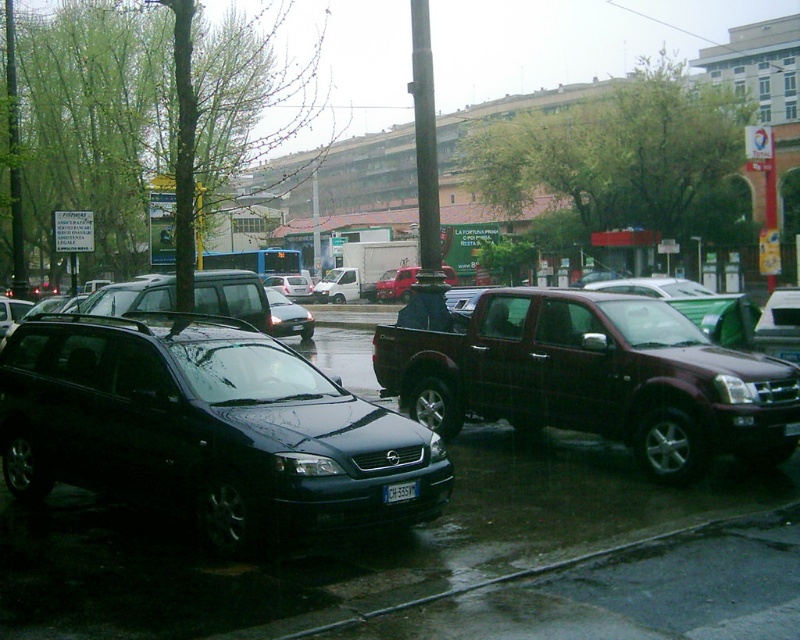
You are a delivery person trying to park your delivery van. You see the dark red metallic pickup truck at center and the black plastic license plate at center. Which object is taller?

The dark red metallic pickup truck at center is much taller than the black plastic license plate at center.

You are a delivery driver who needs to attach a new license plate to your dark red metallic pickup truck at center. The current black plastic license plate at center is too small. What issue might you encounter?

The dark red metallic pickup truck at center has a larger size compared to the black plastic license plate at center, so the current license plate may not be appropriately sized for the truck, leading to installation difficulties or an improper fit.

You are a delivery person needing to cross the street between the dark red metallic pickup truck at center and the shiny black sedan at center. The road is 10 meters wide. Can you safely cross without needing to move any vehicles?

The distance between the dark red metallic pickup truck at center and the shiny black sedan at center is 9.11 meters. Since the road is 10 meters wide, there is enough space between them to cross safely without moving any vehicles.